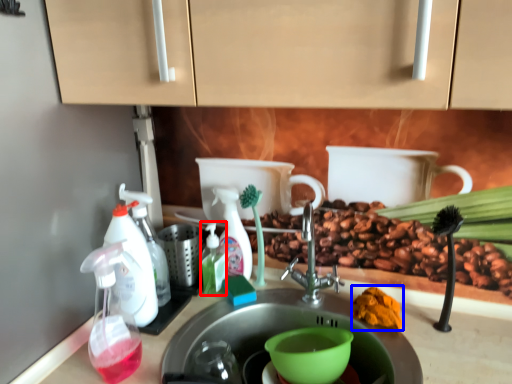
Question: Which point is further to the camera, soap dispenser (highlighted by a red box) or debris (highlighted by a blue box)?

Choices:
 (A) soap dispenser
 (B) debris

Answer: (A)